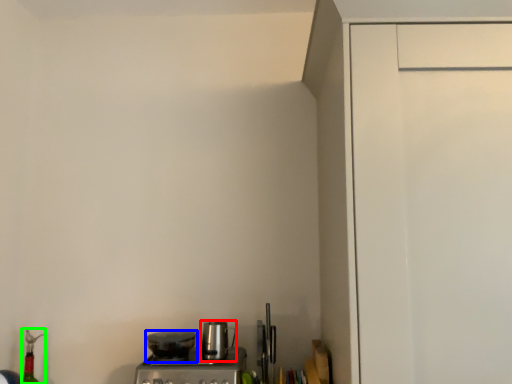
Question: Based on their relative distances, which object is farther from kitchen appliance (highlighted by a red box)? Choose from kitchen appliance (highlighted by a blue box) and bottle (highlighted by a green box).

Choices:
 (A) kitchen appliance
 (B) bottle

Answer: (B)